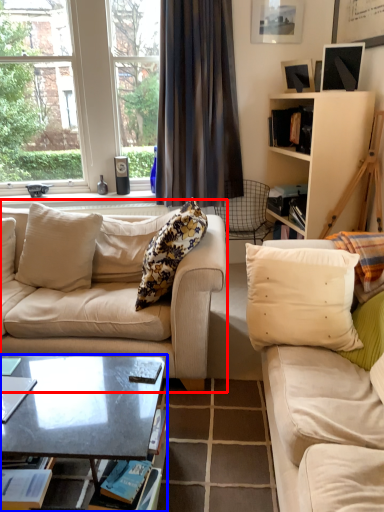
Question: Which object is closer to the camera taking this photo, studio couch (highlighted by a red box) or coffee table (highlighted by a blue box)?

Choices:
 (A) studio couch
 (B) coffee table

Answer: (B)